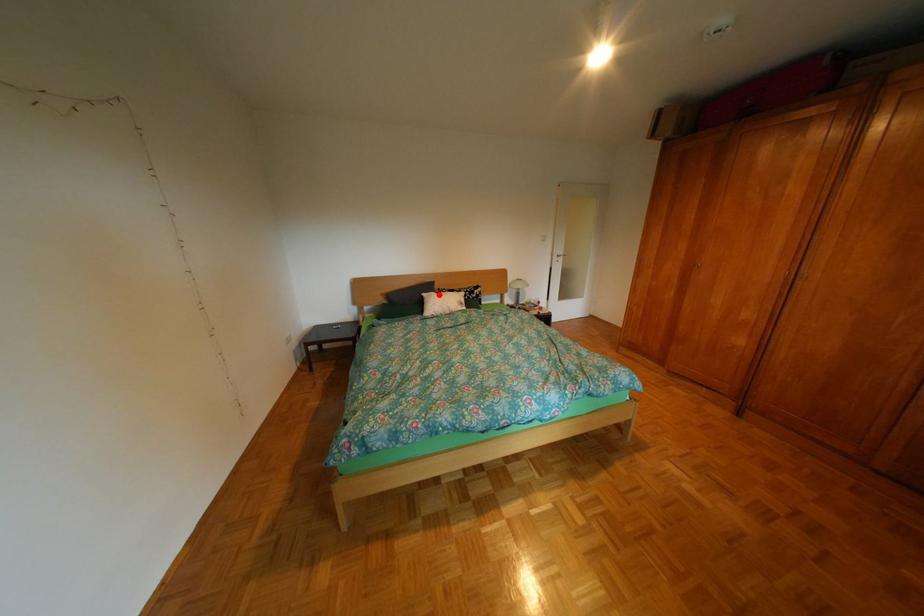
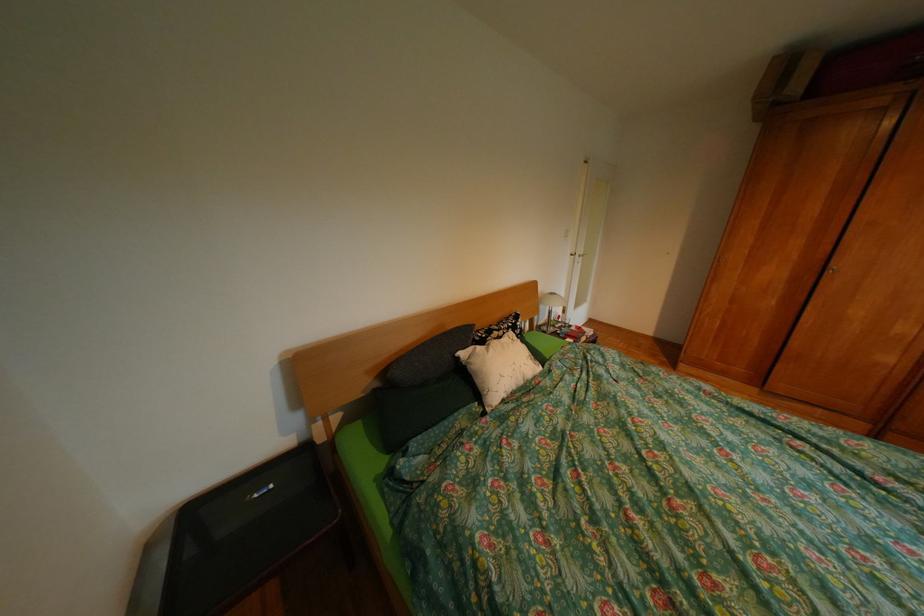
Question: I am providing you with two images of the same scene from different viewpoints. In image1, a red point is highlighted. Considering the same 3D point in image2, which of the following is correct?

Choices:
 (A) It is closer
 (B) It is farther

Answer: (B)